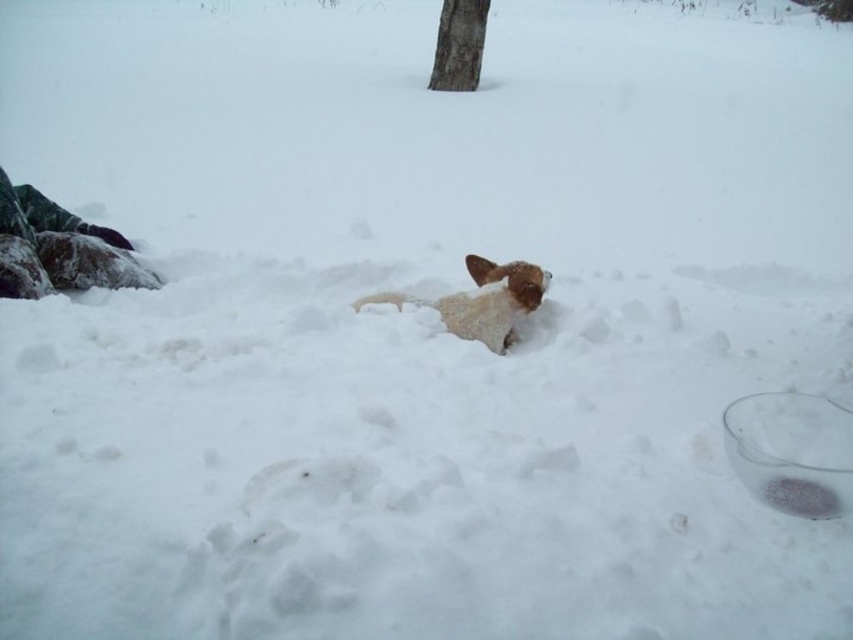
You are a hiker who spots the brown fur dog at center and the brown rough bark tree at upper center in the snowy landscape. Which object is located to the right of the other?

The brown fur dog at center is positioned on the left side of brown rough bark tree at upper center, so the tree is to the right of the dog.

You are a photographer trying to capture the brown fur dog at center and the brown rough bark tree at upper center in the same frame. Based on their sizes, which object should you focus on first to ensure both fit in the frame?

Since the brown fur dog at center is wider than the brown rough bark tree at upper center, you should focus on positioning the brown fur dog at center first to ensure both fit in the frame.

Looking at this image, you are standing at the point with coordinates (482, 300) in the snowy scene. What do you see at that exact location?

At point (482, 300) lies the brown fur dog at center, which is partially buried in the snow with its head and part of its body visible above the snow.